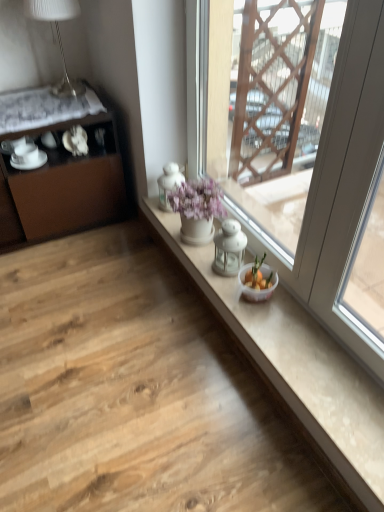
Find the location of a particular element. The image size is (384, 512). free space in front of white glossy table lamp at upper left is located at coordinates (58, 106).